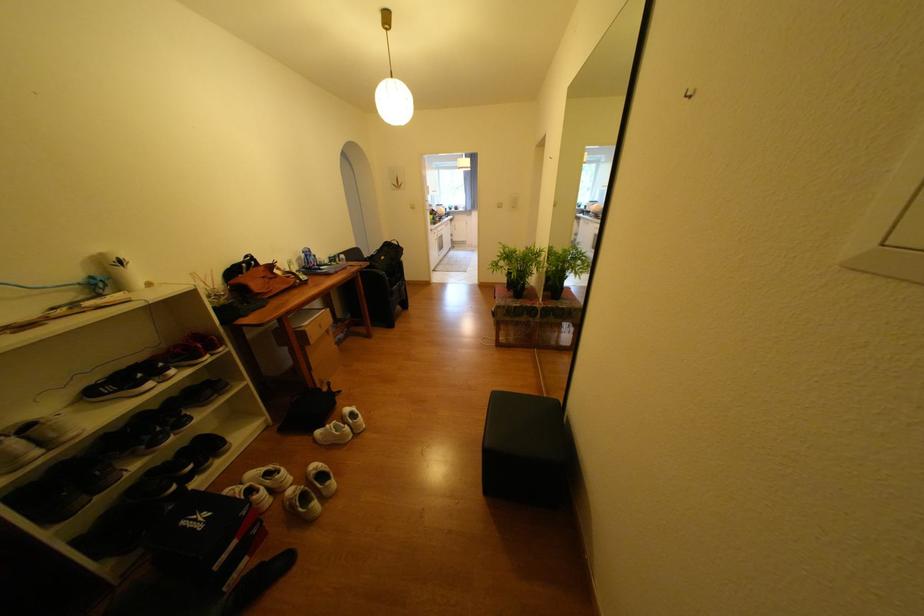
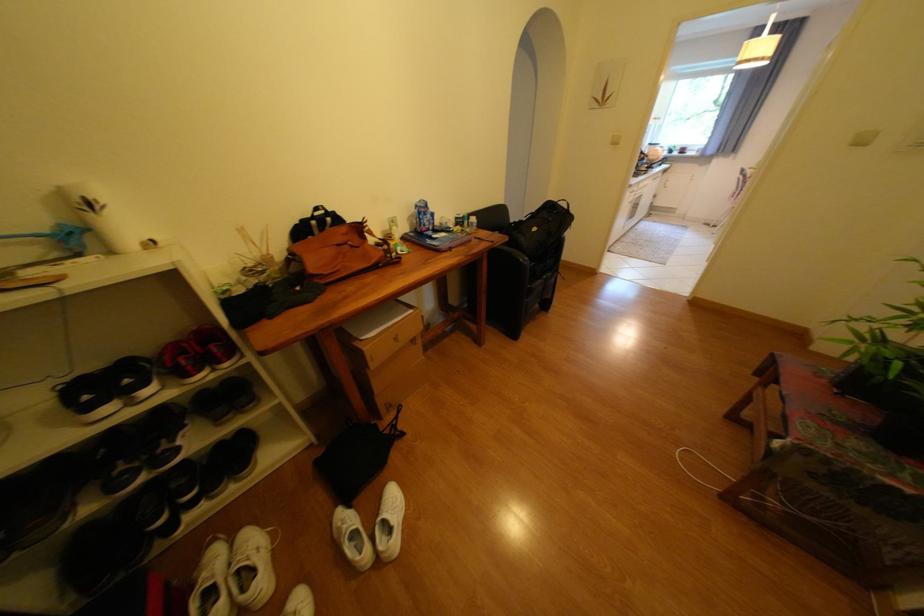
Find the pixel in the second image that matches pixel 271 269 in the first image.

(351, 229)